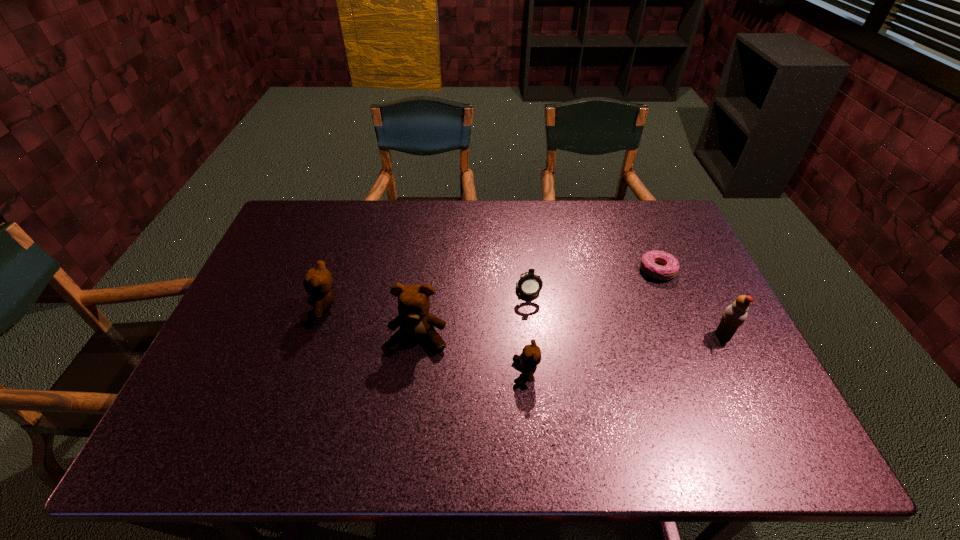
Observe the arrangement of all teddy bears in the image. To keep them evenly spaced, where would you place another teddy bear on the right? Please locate a free space. Please provide its 2D coordinates. Your answer should be formatted as a tuple, i.e. [(x, y)], where the tuple contains the x and y coordinates of a point satisfying the conditions above.

[(650, 411)]